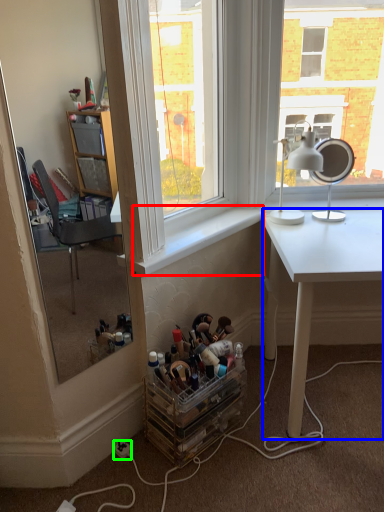
Question: Which object is positioned closest to window sill (highlighted by a red box)? Select from desk (highlighted by a blue box) and power outlet (highlighted by a green box).

Choices:
 (A) desk
 (B) power outlet

Answer: (A)